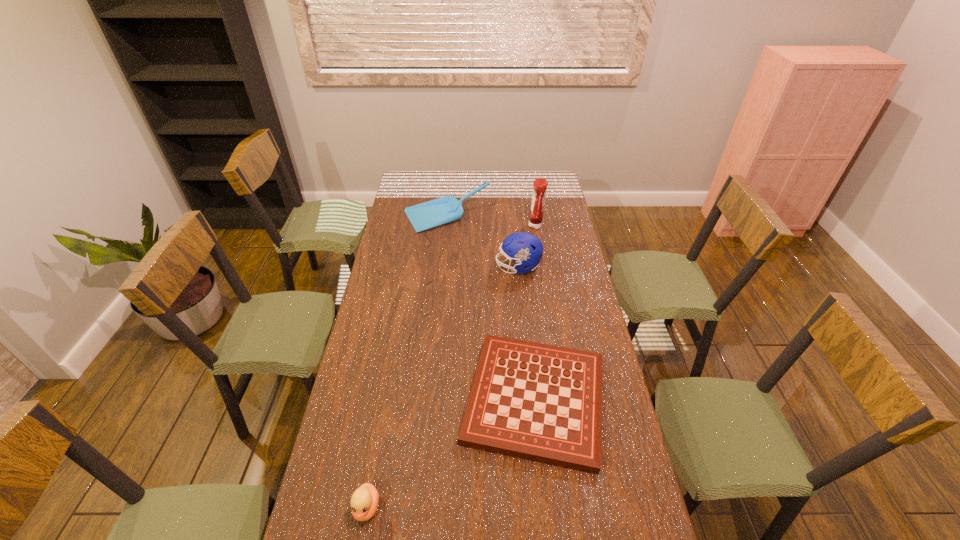
The width and height of the screenshot is (960, 540). In the image, there is a desktop. Identify the location of free space at the far left corner. (409, 179).

Locate an element on the screen. The height and width of the screenshot is (540, 960). vacant space that is in between the condiment and the fourth farthest object is located at coordinates (536, 312).

Identify the location of free area in between the condiment and the fourth farthest object. (536, 312).

Locate an element on the screen. The height and width of the screenshot is (540, 960). free space between the fourth tallest object and the fourth farthest object is located at coordinates (451, 453).

Where is `vacant area that lies between the third nearest object and the duckling`? The image size is (960, 540). vacant area that lies between the third nearest object and the duckling is located at coordinates (443, 387).

At what (x,y) coordinates should I click in order to perform the action: click on unoccupied position between the nearest object and the third nearest object. Please return your answer as a coordinate pair (x, y). The height and width of the screenshot is (540, 960). Looking at the image, I should click on (443, 387).

You are a GUI agent. You are given a task and a screenshot of the screen. Output one action in this format:
    pyautogui.click(x=<x>, y=<y>)
    Task: Click on the free space between the duckling and the tallest object
    Image resolution: width=960 pixels, height=540 pixels.
    Given the screenshot: What is the action you would take?
    pyautogui.click(x=451, y=367)

The width and height of the screenshot is (960, 540). What are the coordinates of `empty location between the duckling and the shortest object` in the screenshot? It's located at (451, 453).

Image resolution: width=960 pixels, height=540 pixels. What are the coordinates of `free space between the duckling and the tallest object` in the screenshot? It's located at (451, 367).

Locate an element on the screen. Image resolution: width=960 pixels, height=540 pixels. free spot between the gameboard and the third tallest object is located at coordinates (491, 308).